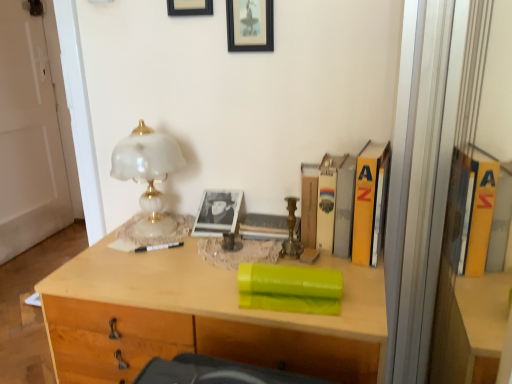
Find the location of a particular element. This screenshot has width=512, height=384. free space in front of black plastic pen at center is located at coordinates (147, 274).